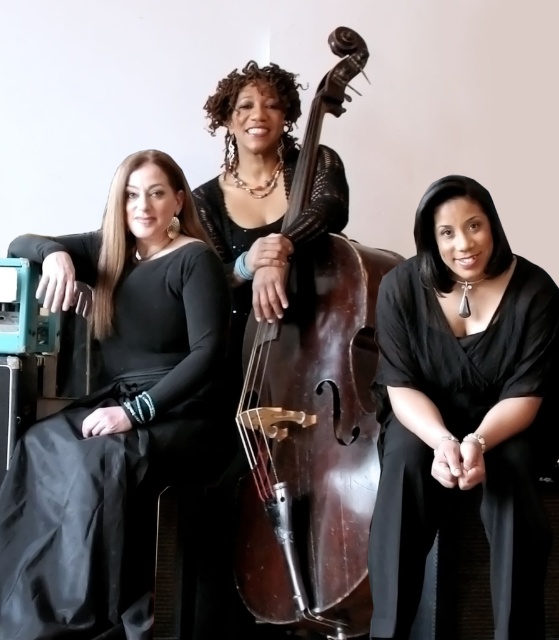
Between black matte dress at left and black silk blouse at center, which one appears on the right side from the viewer's perspective?

From the viewer's perspective, black silk blouse at center appears more on the right side.

Who is shorter, black matte dress at left or black silk blouse at center?

→ black silk blouse at center is shorter.

Find the location of a particular element. The height and width of the screenshot is (640, 559). black matte dress at left is located at coordinates (115, 410).

Who is more distant from viewer, (126, 509) or (312, 112)?

Point (312, 112)

Is black matte dress at left to the left of dark brown polished wood cello at center from the viewer's perspective?

Indeed, black matte dress at left is positioned on the left side of dark brown polished wood cello at center.

Does point (67, 410) come closer to viewer compared to point (250, 340)?

Yes, point (67, 410) is in front of point (250, 340).

This screenshot has height=640, width=559. Identify the location of black matte dress at left. (115, 410).

Does point (475, 186) come behind point (338, 35)?

No, (475, 186) is in front of (338, 35).

Is black silk blouse at center shorter than dark brown polished wood cello at center?

Yes.

This screenshot has width=559, height=640. In order to click on black silk blouse at center in this screenshot , I will do `click(461, 406)`.

This screenshot has width=559, height=640. What are the coordinates of `black silk blouse at center` in the screenshot? It's located at (461, 406).